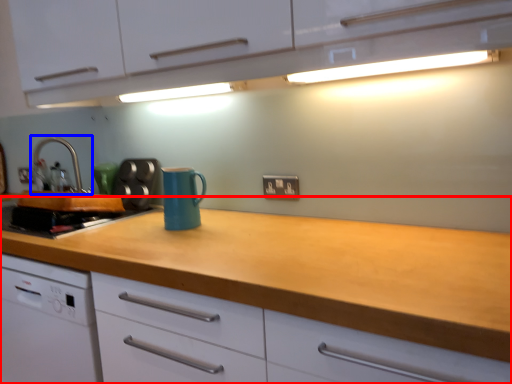
Question: Which object is closer to the camera taking this photo, counter (highlighted by a red box) or tap (highlighted by a blue box)?

Choices:
 (A) counter
 (B) tap

Answer: (A)